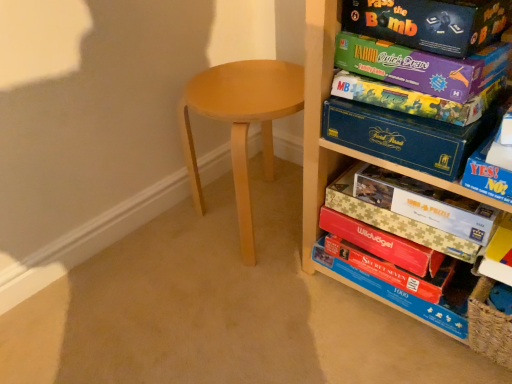
Locate an element on the screen. free space on the front side of blue cardboard puzzle at lower right is located at coordinates (390, 347).